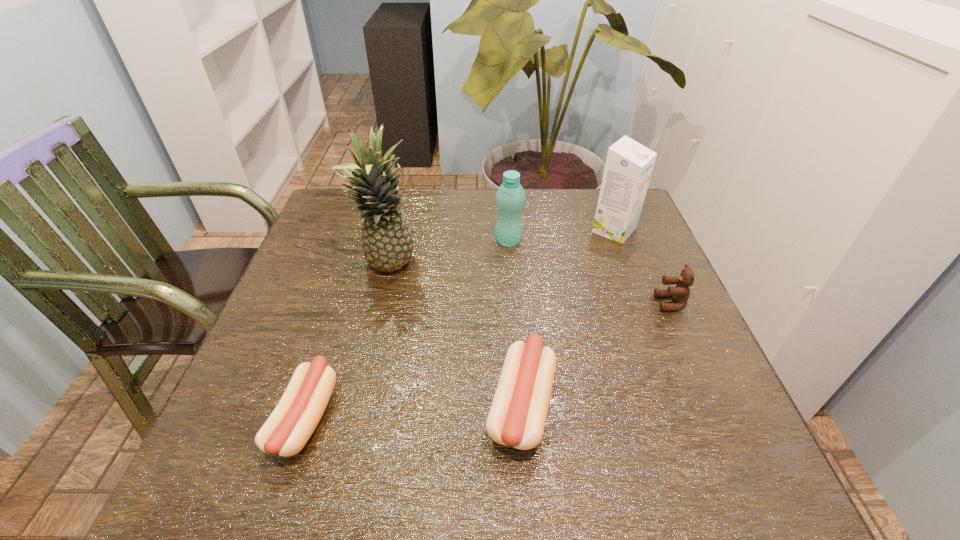
The height and width of the screenshot is (540, 960). What are the coordinates of `pineapple present at the left edge` in the screenshot? It's located at (387, 244).

Locate an element on the screen. The height and width of the screenshot is (540, 960). carton located at the right edge is located at coordinates (629, 165).

Identify the location of teddy bear at the right edge. (680, 294).

Identify the location of object that is at the near left corner. (297, 414).

Locate an element on the screen. object that is at the far right corner is located at coordinates (629, 165).

Locate an element on the screen. The width and height of the screenshot is (960, 540). vacant space at the far edge of the desktop is located at coordinates (548, 205).

Find the location of a particular element. vacant space at the near edge is located at coordinates (368, 435).

What are the coordinates of `vacant space at the left edge` in the screenshot? It's located at pyautogui.click(x=305, y=309).

The image size is (960, 540). I want to click on free space at the right edge, so pos(647,258).

Identify the location of free space at the far left corner. This screenshot has width=960, height=540. click(329, 195).